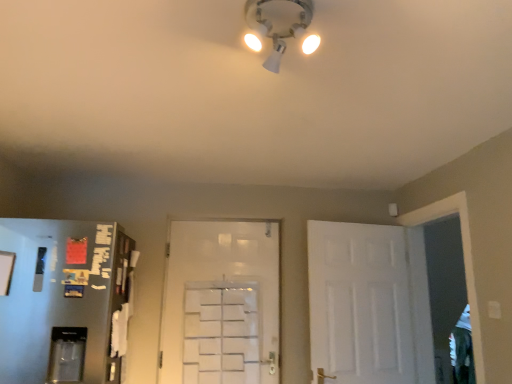
Question: Considering the relative positions of white matte door at center, marked as the second door in a right-to-left arrangement, and white matte door at right, which is counted as the 1th door, starting from the right, in the image provided, is white matte door at center, marked as the second door in a right-to-left arrangement, to the left of white matte door at right, which is counted as the 1th door, starting from the right, from the viewer's perspective?

Choices:
 (A) no
 (B) yes

Answer: (B)

Question: From a real-world perspective, is white matte door at center, marked as the second door in a right-to-left arrangement, located beneath white matte door at right, which is counted as the 1th door, starting from the right?

Choices:
 (A) no
 (B) yes

Answer: (A)

Question: From the image's perspective, is white matte door at center, the 1th door when ordered from left to right, located beneath white matte door at right, the 2th door when ordered from left to right?

Choices:
 (A) no
 (B) yes

Answer: (B)

Question: Does white matte door at center, the 1th door when ordered from left to right, have a greater width compared to white matte door at right, which is counted as the 1th door, starting from the right?

Choices:
 (A) no
 (B) yes

Answer: (A)

Question: Is white matte door at center, marked as the second door in a right-to-left arrangement, aimed at white matte door at right, which is counted as the 1th door, starting from the right?

Choices:
 (A) yes
 (B) no

Answer: (B)

Question: From the image's perspective, is white matte door at center, marked as the second door in a right-to-left arrangement, located above white matte door at right, which is counted as the 1th door, starting from the right?

Choices:
 (A) yes
 (B) no

Answer: (B)

Question: From a real-world perspective, is white matte door at right, which is counted as the 1th door, starting from the right, beneath white plastic light fixture at upper center?

Choices:
 (A) no
 (B) yes

Answer: (B)

Question: Is white matte door at right, the 2th door when ordered from left to right, in front of white plastic light fixture at upper center?

Choices:
 (A) no
 (B) yes

Answer: (A)

Question: Considering the relative sizes of white matte door at right, which is counted as the 1th door, starting from the right, and white plastic light fixture at upper center in the image provided, is white matte door at right, which is counted as the 1th door, starting from the right, thinner than white plastic light fixture at upper center?

Choices:
 (A) no
 (B) yes

Answer: (B)

Question: From a real-world perspective, does white matte door at right, which is counted as the 1th door, starting from the right, stand above white plastic light fixture at upper center?

Choices:
 (A) no
 (B) yes

Answer: (A)

Question: Is white matte door at right, the 2th door when ordered from left to right, oriented towards white plastic light fixture at upper center?

Choices:
 (A) yes
 (B) no

Answer: (B)

Question: Is white matte door at right, the 2th door when ordered from left to right, outside of white plastic light fixture at upper center?

Choices:
 (A) no
 (B) yes

Answer: (B)

Question: Does white matte door at right, the 2th door when ordered from left to right, contain white matte door at center, marked as the second door in a right-to-left arrangement?

Choices:
 (A) yes
 (B) no

Answer: (B)